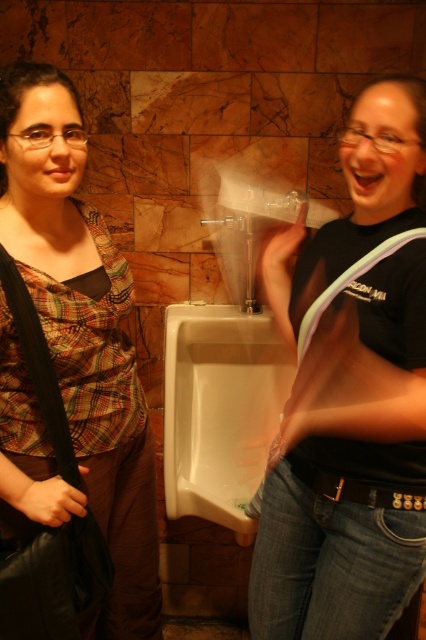
Does point (325, 346) come farther from viewer compared to point (60, 324)?

No, it is in front of (60, 324).

Does black matte shirt at center appear under plaid fabric shirt at left?

Incorrect, black matte shirt at center is not positioned below plaid fabric shirt at left.

The width and height of the screenshot is (426, 640). I want to click on black matte shirt at center, so click(351, 396).

Identify the location of black matte shirt at center. (351, 396).

Does plaid fabric shirt at left lie in front of white glossy urinal at center?

Yes, it is in front of white glossy urinal at center.

Locate an element on the screen. This screenshot has width=426, height=640. plaid fabric shirt at left is located at coordinates (72, 353).

The height and width of the screenshot is (640, 426). Identify the location of plaid fabric shirt at left. (72, 353).

Where is `plaid fabric shirt at left`? This screenshot has height=640, width=426. plaid fabric shirt at left is located at coordinates (72, 353).

Who is higher up, black matte shirt at center or white glossy urinal at center?

black matte shirt at center is above.

Does black matte shirt at center have a lesser width compared to white glossy urinal at center?

Correct, black matte shirt at center's width is less than white glossy urinal at center's.

This screenshot has width=426, height=640. Find the location of `black matte shirt at center`. black matte shirt at center is located at coordinates (351, 396).

Where is `black matte shirt at center`? black matte shirt at center is located at coordinates (351, 396).